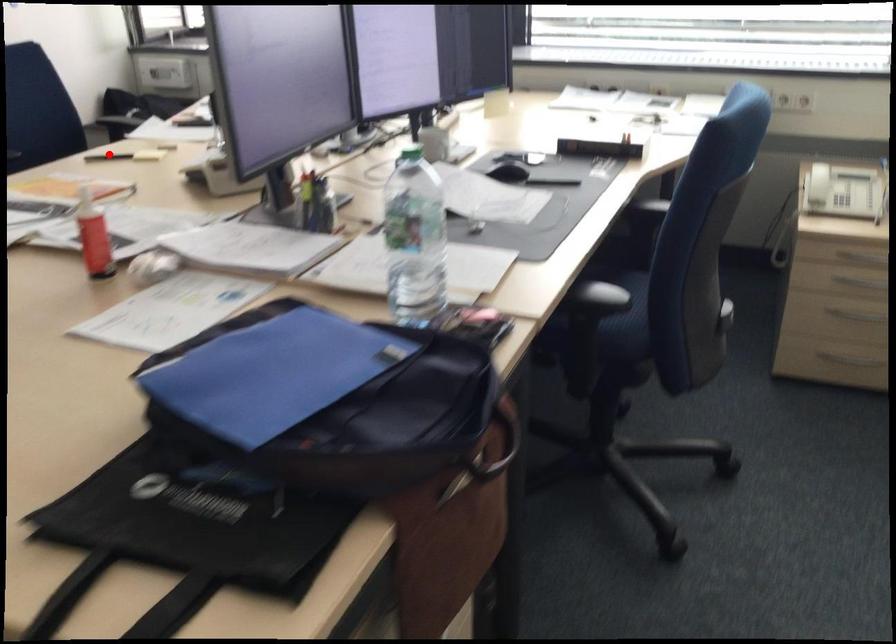
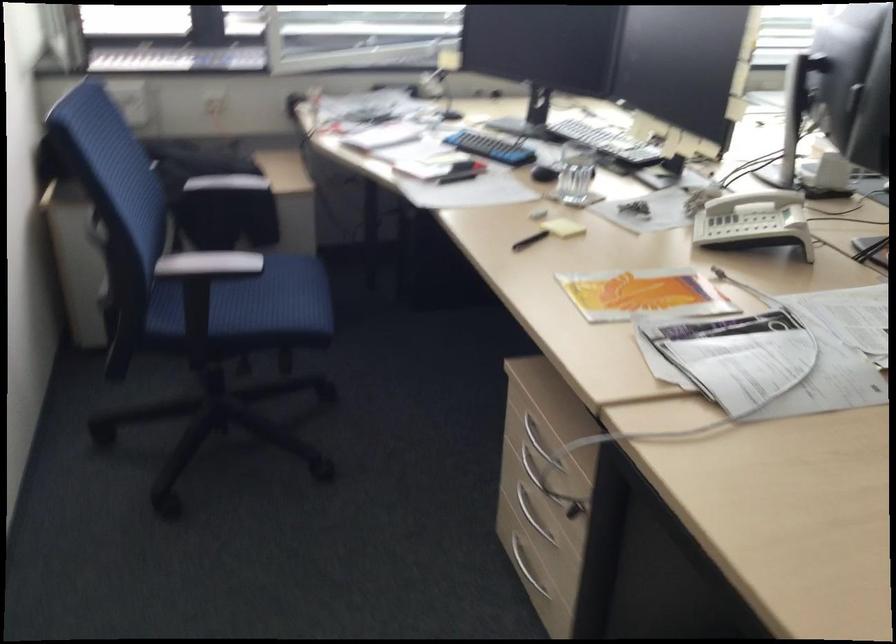
Question: I am providing you with two images of the same scene from different viewpoints. In image1, a red point is highlighted. Considering the same 3D point in image2, which of the following is correct?

Choices:
 (A) It is closer
 (B) It is farther

Answer: (A)